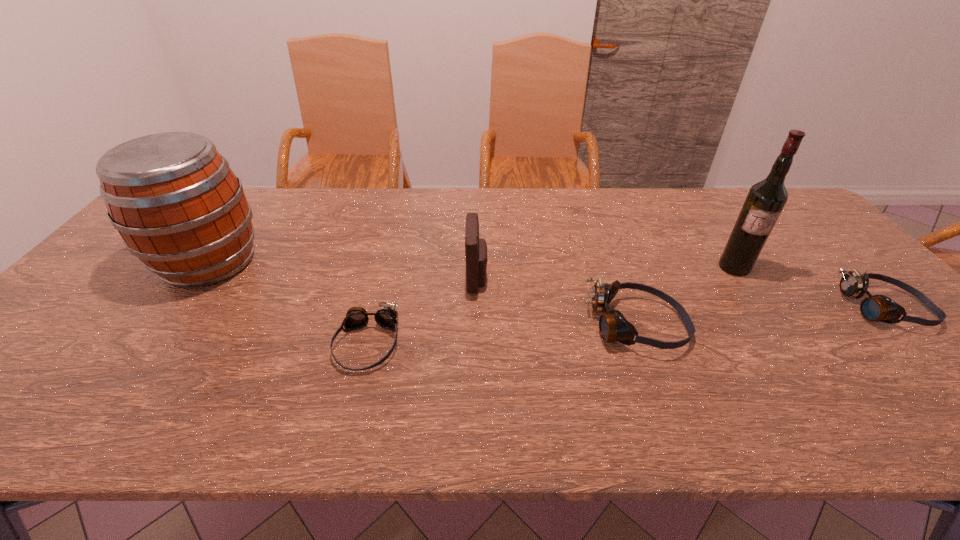
Where is `free spot located 0.160m through the lenses of the third object from right to left`? The height and width of the screenshot is (540, 960). free spot located 0.160m through the lenses of the third object from right to left is located at coordinates (754, 326).

You are a GUI agent. You are given a task and a screenshot of the screen. Output one action in this format:
    pyautogui.click(x=<x>, y=<y>)
    Task: Click on the vacant space located 0.400m with an open flap on the fourth shortest object
    The height and width of the screenshot is (540, 960).
    Given the screenshot: What is the action you would take?
    pyautogui.click(x=635, y=278)

Where is `blank space located 0.180m on the front of the second tallest object`? The image size is (960, 540). blank space located 0.180m on the front of the second tallest object is located at coordinates (143, 353).

Locate an element on the screen. vacant region located 0.330m on the front and back of the second object from right to left is located at coordinates (808, 377).

The width and height of the screenshot is (960, 540). What are the coordinates of `object present at the left edge` in the screenshot? It's located at (178, 206).

At what (x,y) coordinates should I click in order to perform the action: click on object that is positioned at the right edge. Please return your answer as a coordinate pair (x, y). The image size is (960, 540). Looking at the image, I should click on (875, 308).

The height and width of the screenshot is (540, 960). Find the location of `vacant region at the far edge of the desktop`. vacant region at the far edge of the desktop is located at coordinates (293, 196).

I want to click on vacant space at the near edge of the desktop, so click(843, 369).

I want to click on free space at the left edge of the desktop, so click(98, 289).

This screenshot has width=960, height=540. In the image, there is a desktop. Identify the location of free space at the right edge. (832, 270).